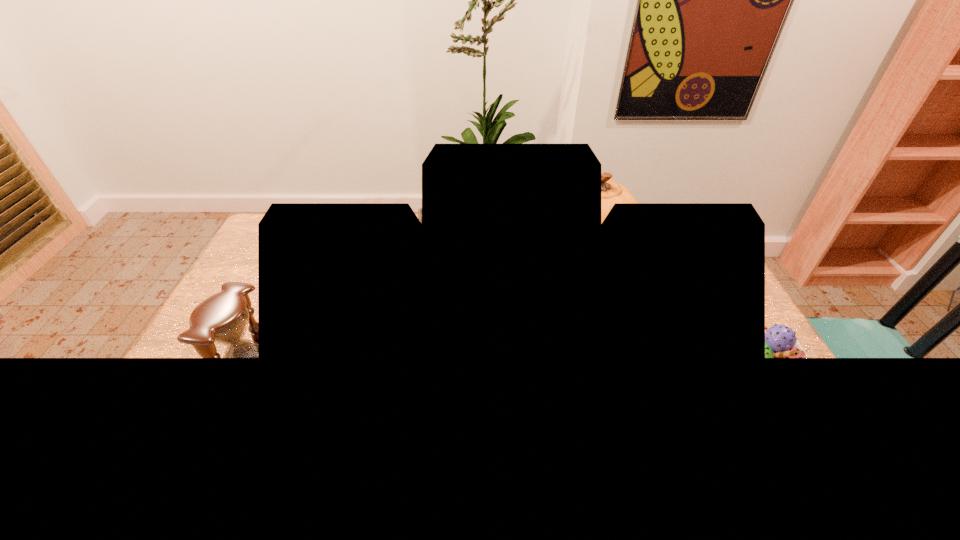
I want to click on the leftmost object, so click(x=222, y=318).

This screenshot has height=540, width=960. Find the location of `the rightmost object`. the rightmost object is located at coordinates (780, 341).

Where is `the shortest object`? The width and height of the screenshot is (960, 540). the shortest object is located at coordinates (780, 341).

Find the location of a particular element. This screenshot has width=960, height=540. pumpkin is located at coordinates (611, 192).

Identify the location of the tallest object. The image size is (960, 540). (611, 192).

Locate an element on the screen. Image resolution: width=960 pixels, height=540 pixels. the third object from right to left is located at coordinates (419, 210).

Locate an element on the screen. The width and height of the screenshot is (960, 540). free space located on the right of the leftmost object is located at coordinates (357, 372).

Identify the location of free space located 0.200m on the left of the icecream. (653, 375).

Locate an element on the screen. vacant space located on the front face of the third object from left to right is located at coordinates (571, 296).

The width and height of the screenshot is (960, 540). What are the coordinates of `free location located 0.120m on the front face of the third object from left to right` in the screenshot? It's located at (571, 299).